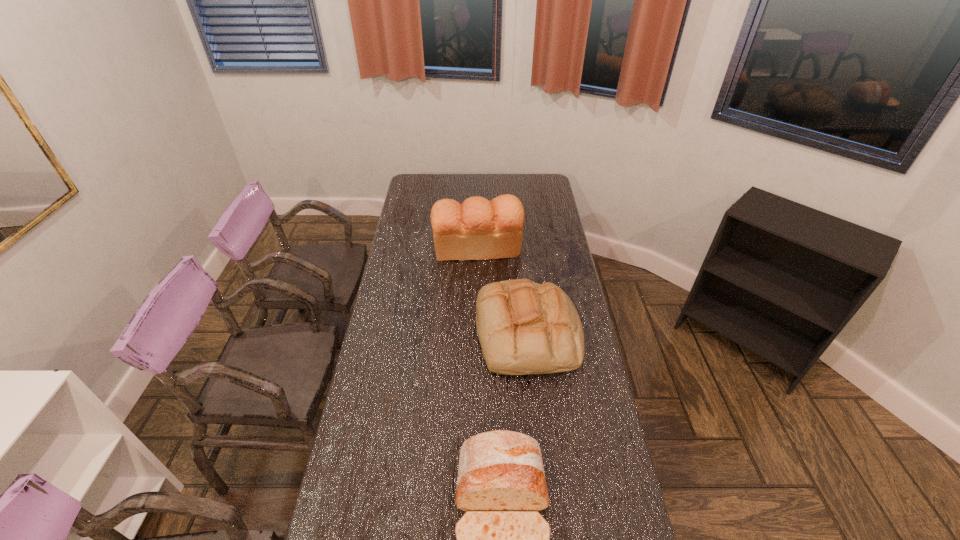
Locate an element on the screen. the farthest bread is located at coordinates (478, 229).

The width and height of the screenshot is (960, 540). I want to click on the tallest bread, so click(478, 229).

The height and width of the screenshot is (540, 960). Find the location of `the second nearest object`. the second nearest object is located at coordinates 524,327.

Locate an element on the screen. Image resolution: width=960 pixels, height=540 pixels. the second tallest bread is located at coordinates point(524,327).

You are a GUI agent. You are given a task and a screenshot of the screen. Output one action in this format:
    pyautogui.click(x=<x>, y=<y>)
    Task: Click on the free region located 0.240m on the back of the tallest bread
    Image resolution: width=960 pixels, height=540 pixels.
    Given the screenshot: What is the action you would take?
    pyautogui.click(x=478, y=205)

Identify the location of vacant space situated 0.060m on the back of the second nearest object. This screenshot has height=540, width=960. (522, 286).

At what (x,y) coordinates should I click in order to perform the action: click on object at the right edge. Please return your answer as a coordinate pair (x, y). This screenshot has height=540, width=960. Looking at the image, I should click on (524, 327).

Locate an element on the screen. This screenshot has height=540, width=960. vacant space at the far edge is located at coordinates (499, 184).

This screenshot has width=960, height=540. I want to click on free spot at the left edge of the desktop, so click(421, 250).

Where is `vacant space at the right edge`? Image resolution: width=960 pixels, height=540 pixels. vacant space at the right edge is located at coordinates (570, 454).